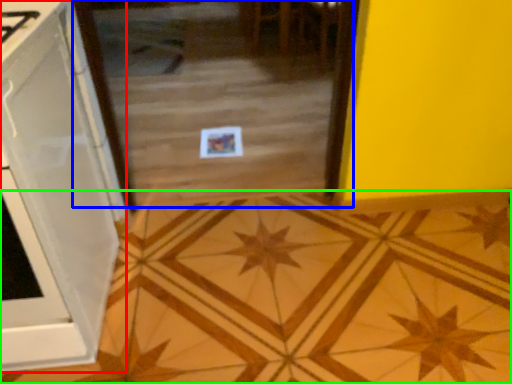
Question: Estimate the real-world distances between objects in this image. Which object is closer to cabinetry (highlighted by a red box), glass door (highlighted by a blue box) or ceramic tile (highlighted by a green box)?

Choices:
 (A) glass door
 (B) ceramic tile

Answer: (B)